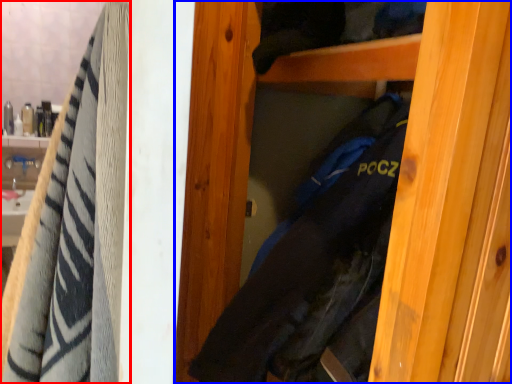
Question: Which of the following is the farthest to the observer, towel (highlighted by a red box) or door (highlighted by a blue box)?

Choices:
 (A) towel
 (B) door

Answer: (A)